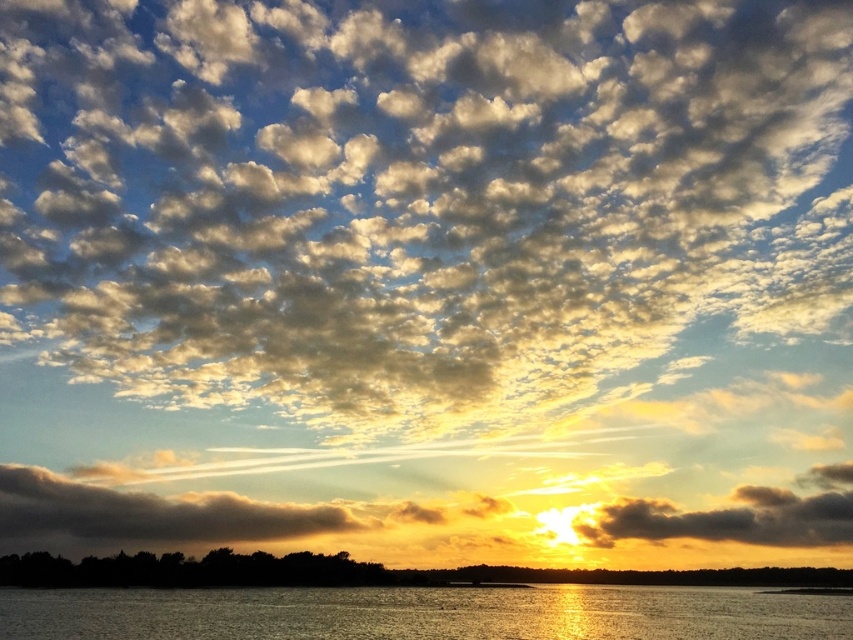
You are standing on the shore looking at the sunset. You notice the cloudy sky at upper center and the silhouetted trees at lower center. Which object is positioned higher in the scene?

The cloudy sky at upper center is positioned higher than the silhouetted trees at lower center.

You are an artist trying to paint the sunset scene. You notice the glistening silver water at lower center and the silhouetted trees at lower center. Which object should you paint first if you want to follow the rule of painting larger objects before smaller ones?

The glistening silver water at lower center should be painted first because it is larger than the silhouetted trees at lower center according to the description.

You are standing at the edge of the water and want to place a floating lantern exactly where the glistening silver water at lower center is located. According to the coordinates provided, where should you place the lantern?

The glistening silver water at lower center is located at point [422,612], so you should place the lantern there.